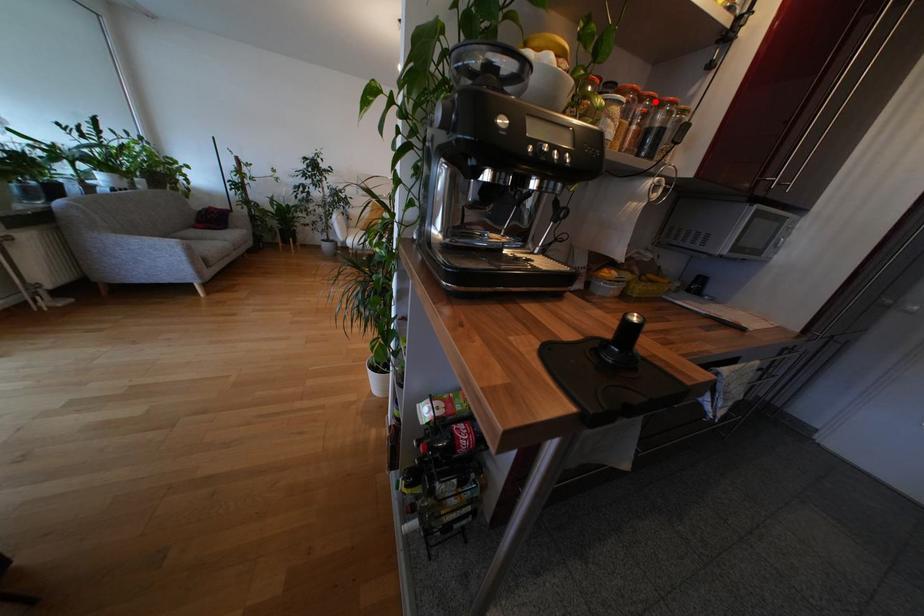
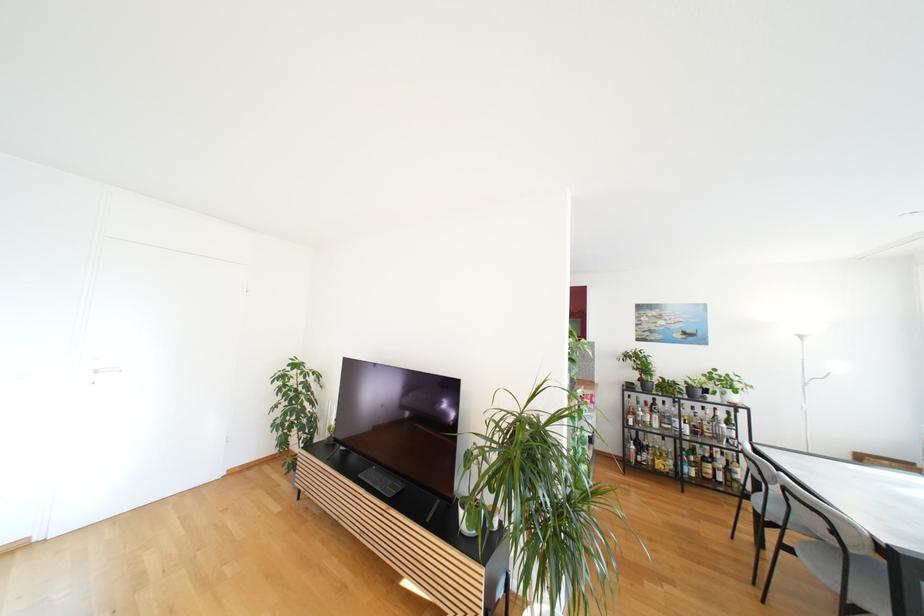
Question: I am providing you with two images of the same scene from different viewpoints. A red point is marked on the first image. Is the red point's position out of view in image 2?

Choices:
 (A) Yes
 (B) No

Answer: (A)